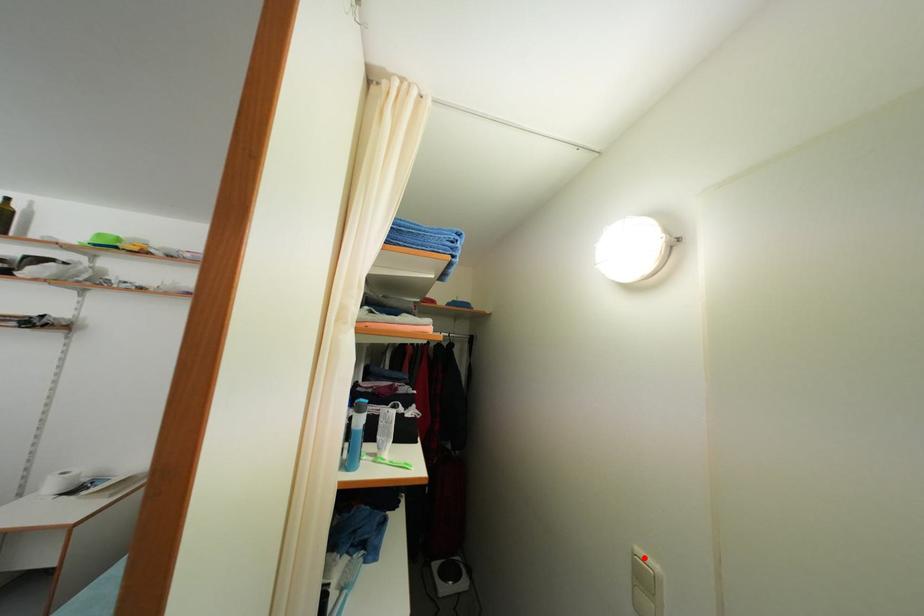
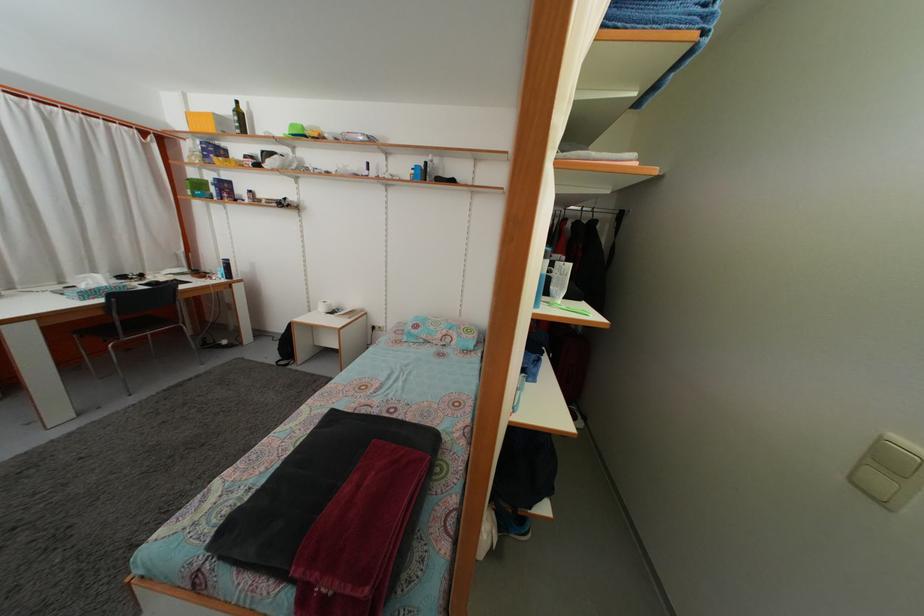
Where in the second image is the point corresponding to the highlighted location from the first image?

(903, 445)